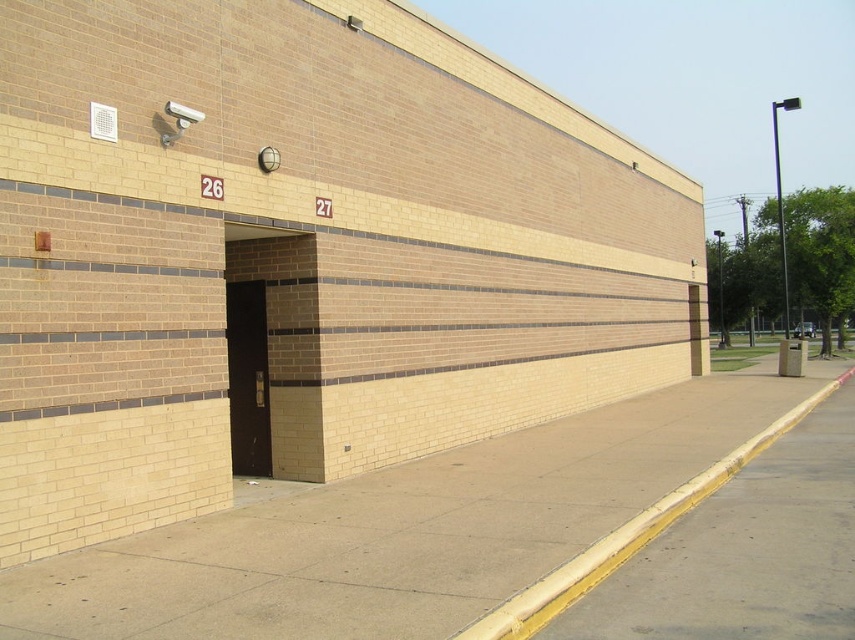
Which is behind, point (447, 493) or point (587, 600)?

The point (447, 493) is more distant.

Is concrete at center closer to the viewer compared to gray concrete sidewalk at lower right?

Yes, it is in front of gray concrete sidewalk at lower right.

Does point (385, 506) come in front of point (584, 596)?

No, (385, 506) is behind (584, 596).

Find the location of `concrete at center`. concrete at center is located at coordinates (399, 529).

This screenshot has width=855, height=640. What do you see at coordinates (746, 552) in the screenshot?
I see `gray concrete sidewalk at lower right` at bounding box center [746, 552].

Where is `gray concrete sidewalk at lower right`? The height and width of the screenshot is (640, 855). gray concrete sidewalk at lower right is located at coordinates (746, 552).

Who is more forward, (133, 589) or (248, 456)?

Point (133, 589)

Does point (139, 620) come in front of point (258, 397)?

Yes, it is.

Image resolution: width=855 pixels, height=640 pixels. In order to click on concrete at center in this screenshot , I will do pyautogui.click(x=399, y=529).